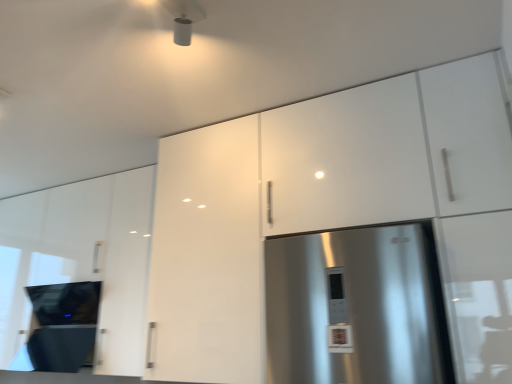
Question: Visually, is white glossy cabinet at center, which is the second cabinetry from right to left, positioned to the left or to the right of black glass cooktop at lower left?

Choices:
 (A) right
 (B) left

Answer: (A)

Question: Is white glossy cabinet at center, which is the second cabinetry from right to left, spatially inside black glass cooktop at lower left, or outside of it?

Choices:
 (A) inside
 (B) outside

Answer: (B)

Question: Estimate the real-world distances between objects in this image. Which object is closer to the white glossy cabinet at center, which appears as the second cabinetry when viewed from the left?

Choices:
 (A) glossy white cabinet at upper left, acting as the 1th cabinetry starting from the left
 (B) white glossy cabinet at upper right, positioned as the 1th cabinetry in right-to-left order
 (C) black glass cooktop at lower left

Answer: (B)

Question: Based on their relative distances, which object is farther from the white glossy cabinet at upper right, positioned as the 1th cabinetry in right-to-left order?

Choices:
 (A) white glossy cabinet at center, which appears as the second cabinetry when viewed from the left
 (B) glossy white cabinet at upper left, acting as the 1th cabinetry starting from the left
 (C) black glass cooktop at lower left

Answer: (C)